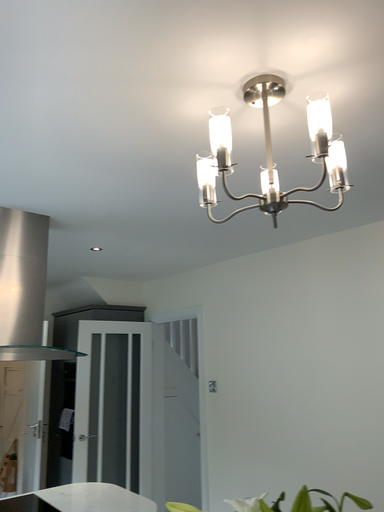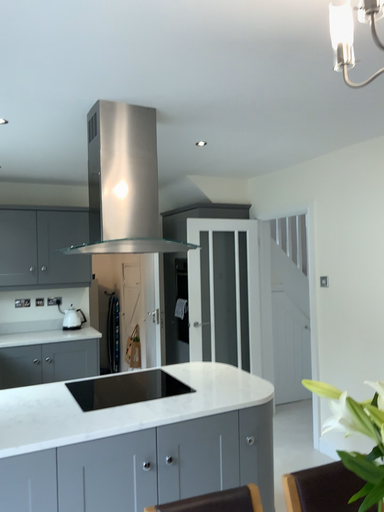
Question: Which way did the camera rotate in the video?

Choices:
 (A) rotated left
 (B) rotated right

Answer: (A)